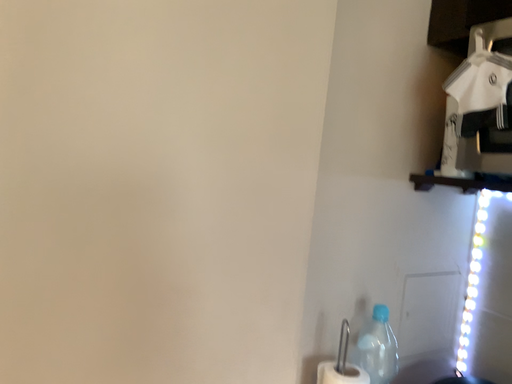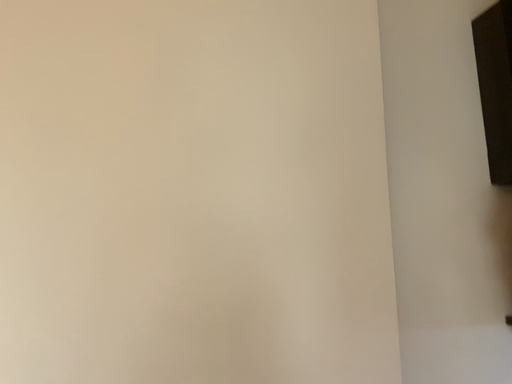
Question: How did the camera likely rotate when shooting the video?

Choices:
 (A) rotated left
 (B) rotated right

Answer: (A)